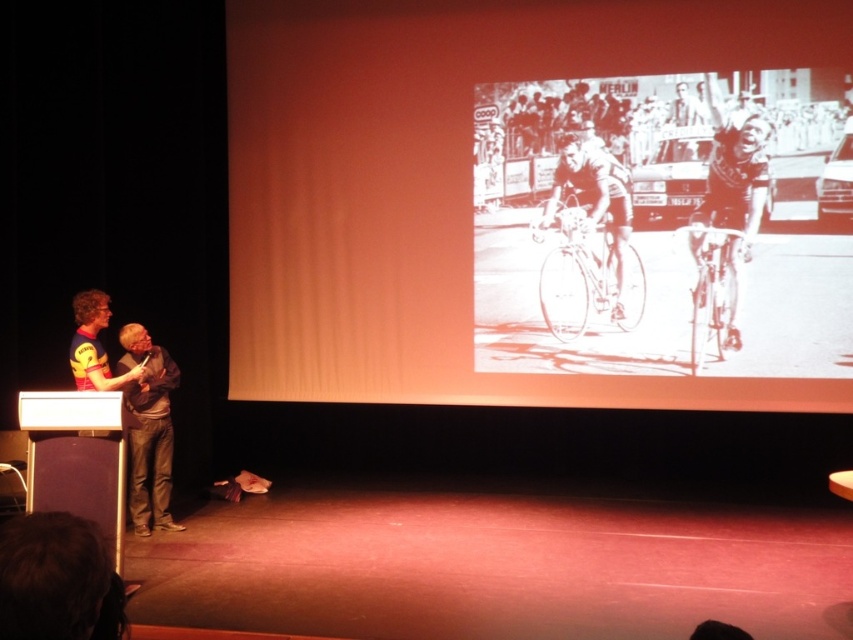
Which is behind, point (141, 502) or point (622, 268)?

The point (622, 268) is behind.

Who is positioned more to the right, matte black shirt at left or white fabric cyclist at center?

Positioned to the right is white fabric cyclist at center.

Where is `matte black shirt at left`? The height and width of the screenshot is (640, 853). matte black shirt at left is located at coordinates pyautogui.click(x=148, y=428).

Identify the location of matte black shirt at left. (148, 428).

Can you confirm if black and white drawing of cyclists at center is thinner than smooth skin cyclist at center?

No, black and white drawing of cyclists at center is not thinner than smooth skin cyclist at center.

Does point (735, 333) lie behind point (694, 212)?

No, (735, 333) is closer to viewer.

The width and height of the screenshot is (853, 640). I want to click on black and white drawing of cyclists at center, so click(x=532, y=200).

Is smooth skin cyclist at center positioned behind yellow jersey at left?

Yes, it is behind yellow jersey at left.

Between smooth skin cyclist at center and yellow jersey at left, which one has less height?

Standing shorter between the two is yellow jersey at left.

Is point (730, 310) farther from camera compared to point (80, 323)?

That is True.

What are the coordinates of `smooth skin cyclist at center` in the screenshot? It's located at (728, 211).